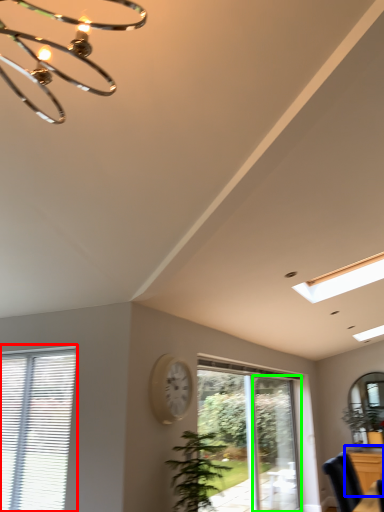
Question: Which object is the closest to the window (highlighted by a red box)? Choose among these: dresser (highlighted by a blue box) or screen door (highlighted by a green box).

Choices:
 (A) dresser
 (B) screen door

Answer: (B)